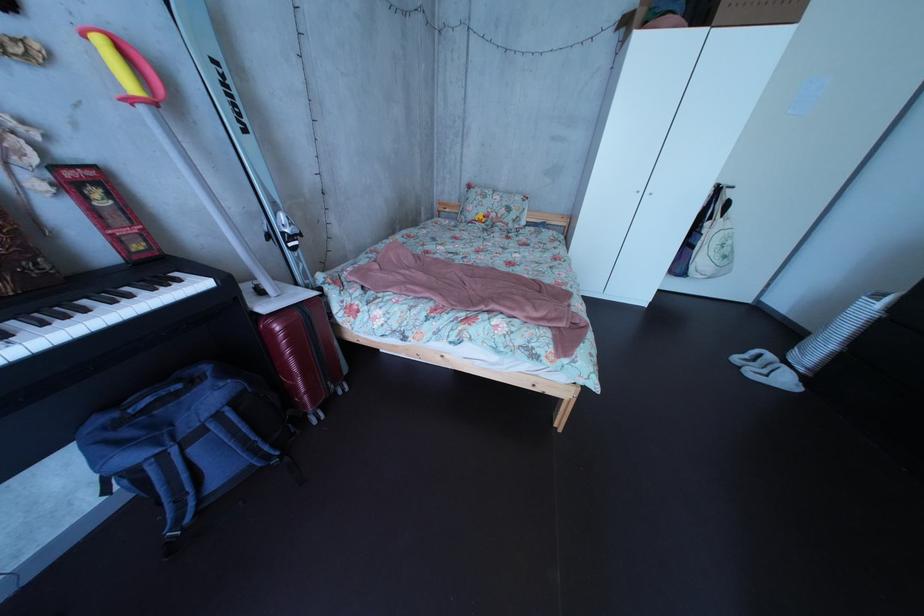
What do you see at coordinates (161, 400) in the screenshot? This screenshot has width=924, height=616. I see `the blue backpack handle` at bounding box center [161, 400].